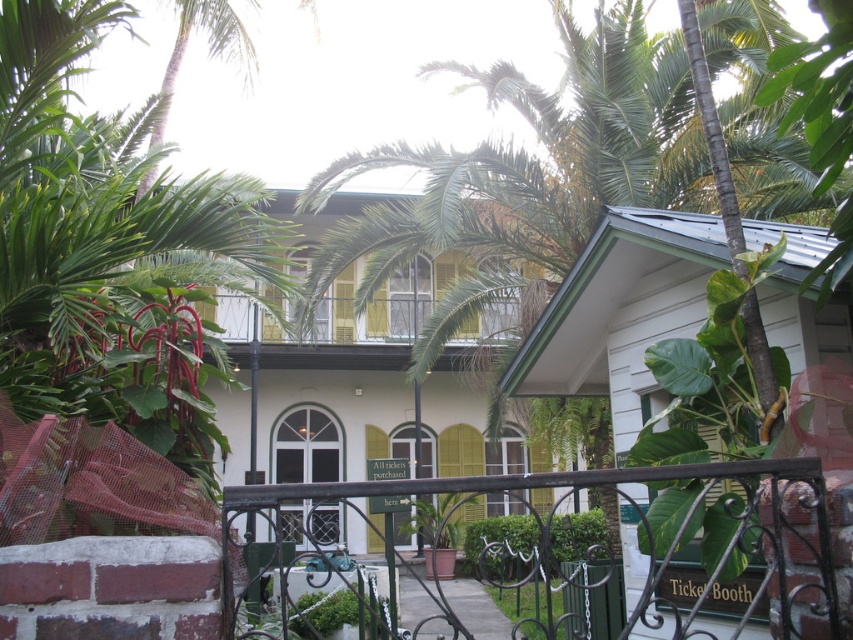
Question: In this image, where is green wrought iron fence at center located relative to wooden balcony at center?

Choices:
 (A) right
 (B) left

Answer: (A)

Question: Does green wrought iron fence at center lie in front of wooden balcony at center?

Choices:
 (A) yes
 (B) no

Answer: (A)

Question: Which of the following is the closest to the observer?

Choices:
 (A) (422, 582)
 (B) (488, 312)

Answer: (B)

Question: Is green wrought iron fence at center closer to the viewer compared to wooden balcony at center?

Choices:
 (A) yes
 (B) no

Answer: (A)